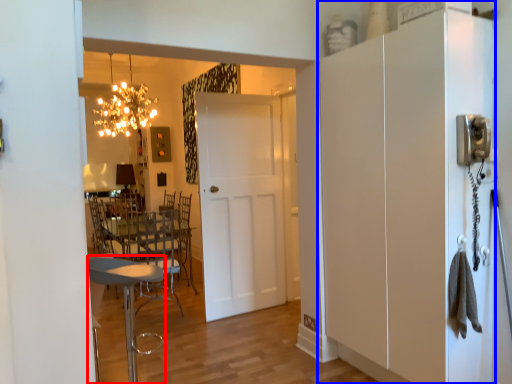
Question: Which point is closer to the camera, chair (highlighted by a red box) or cabinetry (highlighted by a blue box)?

Choices:
 (A) chair
 (B) cabinetry

Answer: (B)